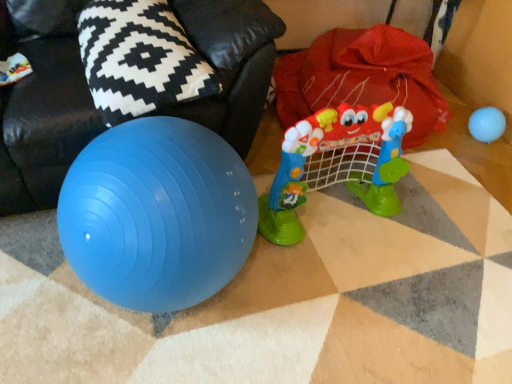
Question: From a real-world perspective, is plastic toy at center, which is the first toy from left to right, positioned under black and white patterned pillow at upper left based on gravity?

Choices:
 (A) yes
 (B) no

Answer: (A)

Question: Is plastic toy at center, arranged as the second toy when viewed from the back, not near black and white patterned pillow at upper left?

Choices:
 (A) yes
 (B) no

Answer: (B)

Question: From the image's perspective, would you say plastic toy at center, the first toy from the front, is shown under black and white patterned pillow at upper left?

Choices:
 (A) no
 (B) yes

Answer: (B)

Question: From the image's perspective, is plastic toy at center, the first toy from the front, over black and white patterned pillow at upper left?

Choices:
 (A) yes
 (B) no

Answer: (B)

Question: Is plastic toy at center, which is the first toy from left to right, directly adjacent to black and white patterned pillow at upper left?

Choices:
 (A) yes
 (B) no

Answer: (B)

Question: Which is correct: blue rubber ball at upper right, the first toy positioned from the back, is inside black and white patterned pillow at upper left, or outside of it?

Choices:
 (A) inside
 (B) outside

Answer: (B)

Question: Visually, is blue rubber ball at upper right, which appears as the 2th toy when viewed from the front, positioned to the left or to the right of black and white patterned pillow at upper left?

Choices:
 (A) right
 (B) left

Answer: (A)

Question: Is point (489, 130) closer or farther from the camera than point (142, 48)?

Choices:
 (A) closer
 (B) farther

Answer: (B)

Question: From their relative heights in the image, would you say blue rubber ball at upper right, which appears as the 2th toy when viewed from the front, is taller or shorter than black and white patterned pillow at upper left?

Choices:
 (A) short
 (B) tall

Answer: (A)

Question: From a real-world perspective, is black and white patterned pillow at upper left physically located above or below plastic toy at center, arranged as the second toy when viewed from the back?

Choices:
 (A) above
 (B) below

Answer: (A)

Question: In terms of size, does black and white patterned pillow at upper left appear bigger or smaller than plastic toy at center, the first toy from the front?

Choices:
 (A) big
 (B) small

Answer: (B)

Question: From the image's perspective, is black and white patterned pillow at upper left above or below plastic toy at center, arranged as the second toy when viewed from the back?

Choices:
 (A) below
 (B) above

Answer: (B)

Question: Does point click(150, 49) appear closer or farther from the camera than point click(296, 158)?

Choices:
 (A) farther
 (B) closer

Answer: (B)

Question: In terms of width, does blue rubber ball at upper right, the first toy positioned from the back, look wider or thinner when compared to plastic toy at center, arranged as the second toy when viewed from the back?

Choices:
 (A) thin
 (B) wide

Answer: (A)

Question: Considering the positions of blue rubber ball at upper right, which appears as the 2th toy when viewed from the front, and plastic toy at center, the 2th toy viewed from the right, in the image, is blue rubber ball at upper right, which appears as the 2th toy when viewed from the front, taller or shorter than plastic toy at center, the 2th toy viewed from the right,?

Choices:
 (A) short
 (B) tall

Answer: (A)